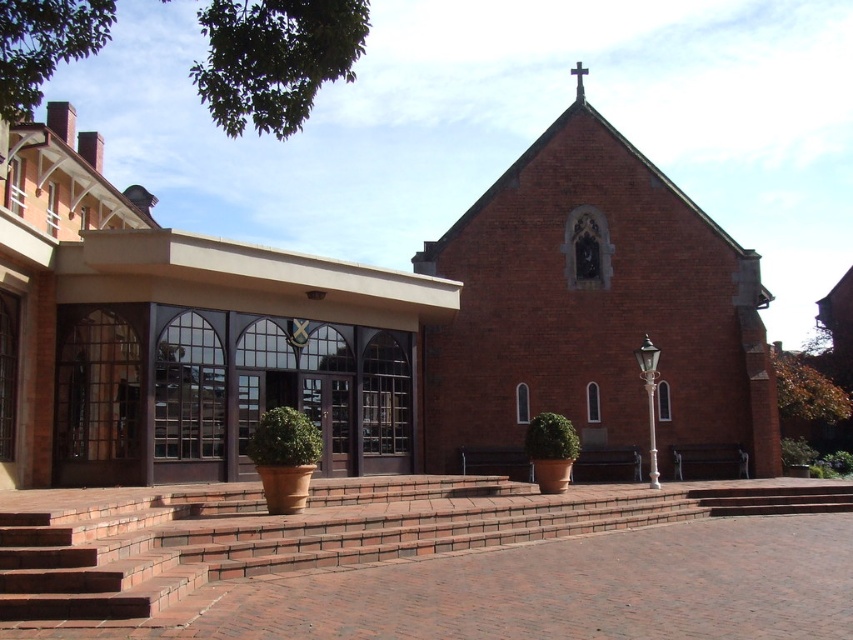
You are standing at the point marked by coordinates point (x=596, y=307). What structure are you directly in front of?

The point (x=596, y=307) marks the brick chapel at center, so you are directly in front of the brick chapel at center.

You are planning to host a large gathering and need to choose between the brick church at center and the brick chapel at center for the event. Based on their sizes, which venue would you recommend and why?

The brick church at center is bigger than the brick chapel at center, so it would be more suitable for hosting a large gathering due to its larger capacity.

You are standing in front of the church and want to take a photo that includes both the brick church at center and the brick chapel at center. Which one should you position closer to the camera to ensure both are in focus?

The brick church at center is closer to the viewer than the brick chapel at center, so you should position the camera closer to the brick church at center to ensure both are in focus.